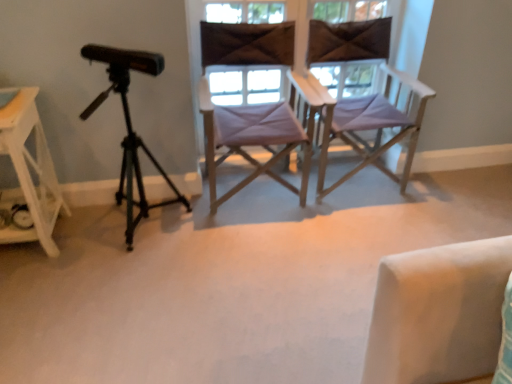
I want to click on vacant area in front of white wood side table at left, so click(30, 291).